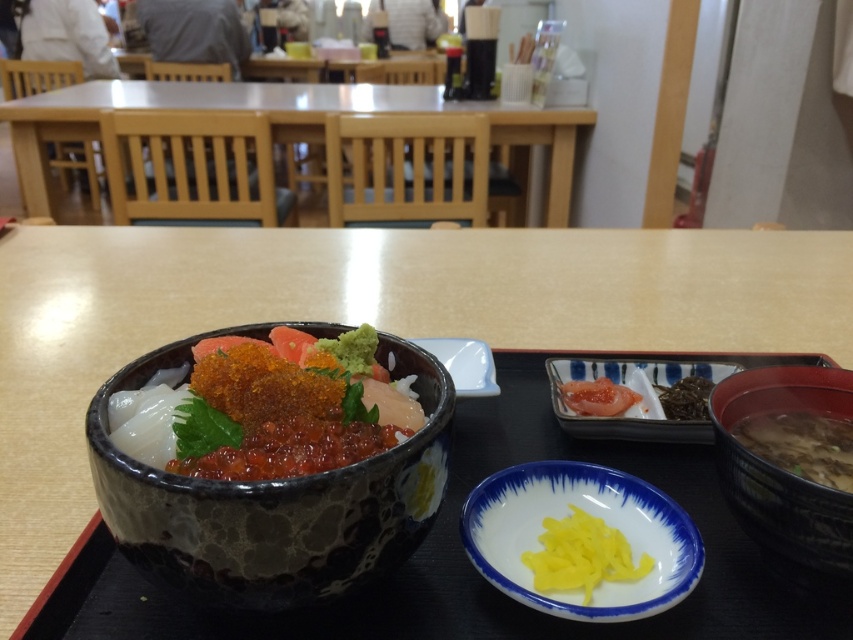
You are a server in a Japanese restaurant and need to place a napkin on the table between the shiny ceramic bowl of sashimi at center and the white glossy plate at center. Since the napkin is 20 cm wide, will it fit between them?

The shiny ceramic bowl of sashimi at center is wider than the white glossy plate at center. However, the description does not provide the exact distance between them, so we cannot determine if the napkin will fit.

Consider the image. You are a customer sitting at the table in the Japanese restaurant. You want to reach for the two points mentioned in the scene. Which point is closer to you, point [326,458] or point [463,390]?

Point [326,458] is in front of point [463,390], so it is closer to you.